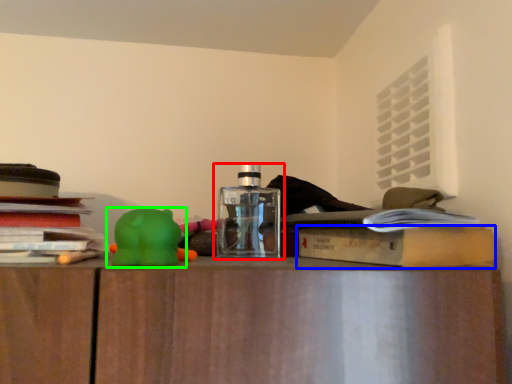
Question: Considering the real-world distances, which object is closest to bottle (highlighted by a red box)? paperback book (highlighted by a blue box) or toy (highlighted by a green box).

Choices:
 (A) paperback book
 (B) toy

Answer: (B)